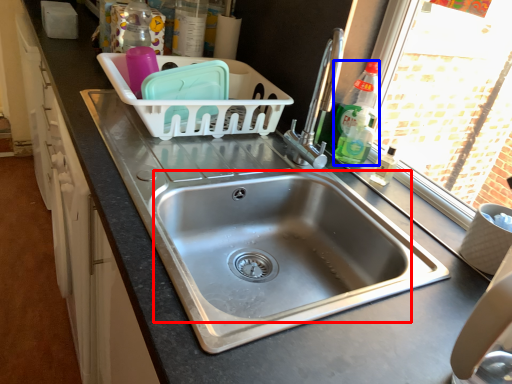
Question: Which point is closer to the camera, sink (highlighted by a red box) or bottle (highlighted by a blue box)?

Choices:
 (A) sink
 (B) bottle

Answer: (A)